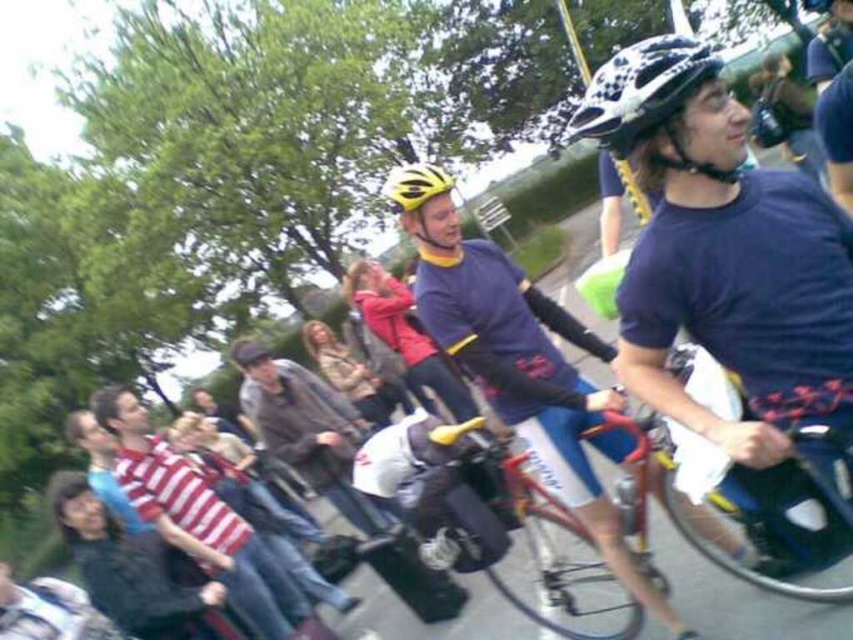
Does matte purple shirt at center come in front of leather jacket at center?

That is True.

The height and width of the screenshot is (640, 853). What do you see at coordinates (525, 372) in the screenshot?
I see `matte purple shirt at center` at bounding box center [525, 372].

Image resolution: width=853 pixels, height=640 pixels. What do you see at coordinates (525, 372) in the screenshot? I see `matte purple shirt at center` at bounding box center [525, 372].

Identify the location of matte purple shirt at center. Image resolution: width=853 pixels, height=640 pixels. (525, 372).

Can you confirm if matte black helmet at upper right is thinner than leather jacket at center?

Indeed, matte black helmet at upper right has a lesser width compared to leather jacket at center.

Who is higher up, matte black helmet at upper right or leather jacket at center?

matte black helmet at upper right is above.

I want to click on matte black helmet at upper right, so click(785, 115).

Is shiny metallic bicycle at center above dark brown leather jacket at center?

No, shiny metallic bicycle at center is not above dark brown leather jacket at center.

Which is more to the left, shiny metallic bicycle at center or dark brown leather jacket at center?

dark brown leather jacket at center

Who is more distant from viewer, (637, 422) or (271, 451)?

Point (271, 451)

Locate an element on the screen. The image size is (853, 640). shiny metallic bicycle at center is located at coordinates (715, 516).